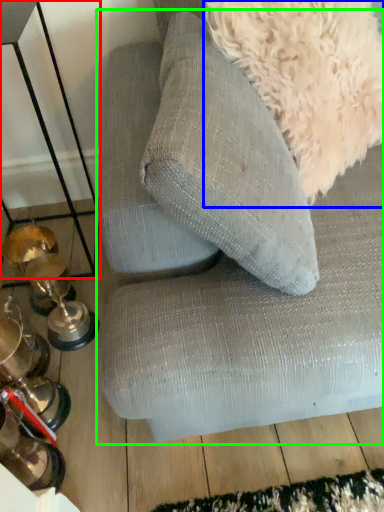
Question: Which object is positioned closest to table (highlighted by a red box)? Select from dog (highlighted by a blue box) and studio couch (highlighted by a green box).

Choices:
 (A) dog
 (B) studio couch

Answer: (B)